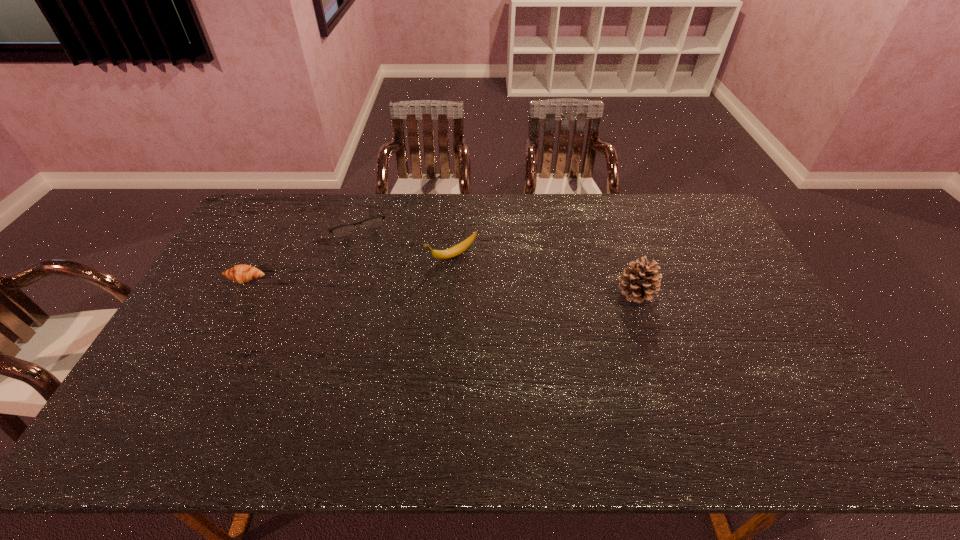
Where is `empty space between the spectacles and the leftmost object`? Image resolution: width=960 pixels, height=540 pixels. empty space between the spectacles and the leftmost object is located at coordinates (300, 249).

Where is `vacant area between the third object from right to left and the banana`? The height and width of the screenshot is (540, 960). vacant area between the third object from right to left and the banana is located at coordinates (403, 238).

At what (x,y) coordinates should I click in order to perform the action: click on empty space that is in between the pastry and the tallest object. Please return your answer as a coordinate pair (x, y). Image resolution: width=960 pixels, height=540 pixels. Looking at the image, I should click on (441, 286).

Locate an element on the screen. The width and height of the screenshot is (960, 540). object that stands as the closest to the pastry is located at coordinates (344, 230).

Identify the location of object that is the third closest one to the tallest object. The width and height of the screenshot is (960, 540). click(242, 273).

The height and width of the screenshot is (540, 960). I want to click on vacant space that satisfies the following two spatial constraints: 1. on the front-facing side of the leftmost object; 2. on the right side of the pinecone, so click(238, 293).

Locate an element on the screen. free location that satisfies the following two spatial constraints: 1. on the front side of the farthest object; 2. on the left side of the third shortest object is located at coordinates (342, 256).